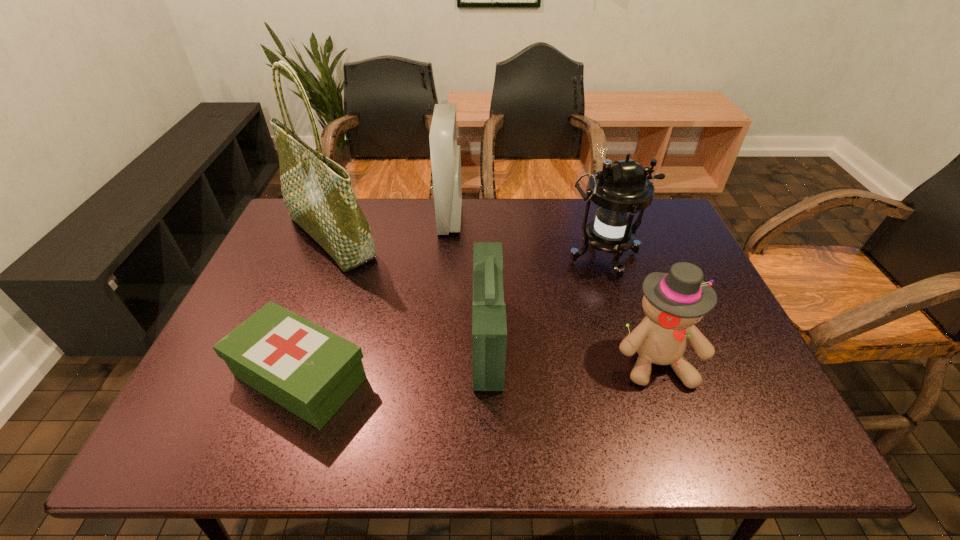
In order to click on object present at the near edge in this screenshot , I will do `click(310, 371)`.

The height and width of the screenshot is (540, 960). Find the location of `shopping bag present at the left edge`. shopping bag present at the left edge is located at coordinates 317,192.

The height and width of the screenshot is (540, 960). I want to click on the first-aid kit located at the left edge, so click(310, 371).

This screenshot has width=960, height=540. I want to click on lantern situated at the right edge, so click(620, 190).

Locate an element on the screen. The height and width of the screenshot is (540, 960). rag_doll positioned at the right edge is located at coordinates (673, 302).

Locate an element on the screen. The width and height of the screenshot is (960, 540). object located in the far left corner section of the desktop is located at coordinates (317, 192).

I want to click on object that is at the near left corner, so click(x=310, y=371).

Image resolution: width=960 pixels, height=540 pixels. Find the location of `object that is at the far right corner`. object that is at the far right corner is located at coordinates (620, 190).

The width and height of the screenshot is (960, 540). I want to click on vacant point at the far edge, so click(x=562, y=217).

Where is `vacant area at the near edge of the desktop`? vacant area at the near edge of the desktop is located at coordinates (546, 420).